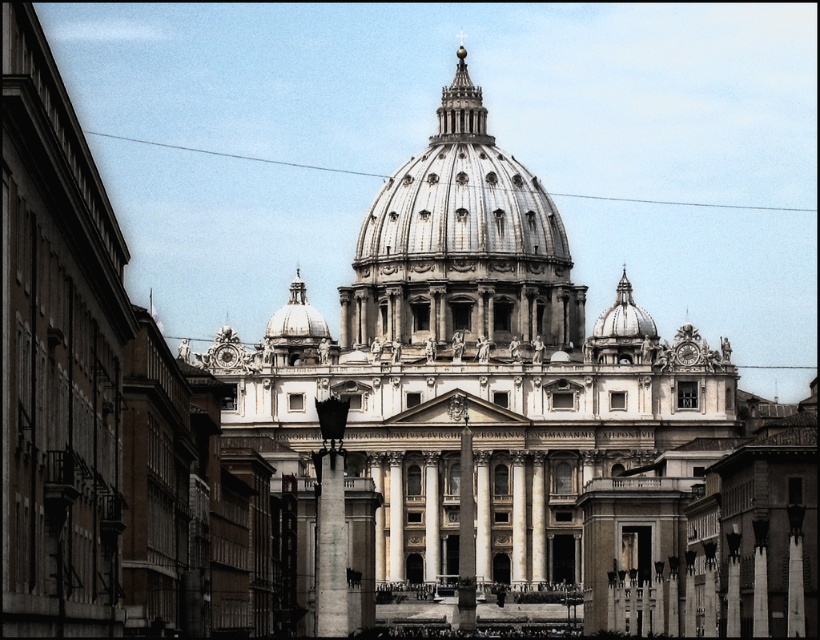
You are standing in front of a historical building and want to take a photo of the shiny silver dome at center. The camera you have can focus on objects up to 160 meters away. Will the dome be in focus?

The shiny silver dome at center is 159.08 meters from viewer, so yes, the camera can focus on it since it is within the 160 meters range.

You are an architect examining the grand structure. You notice the white marble church at center and the white marble pillar at center. Which of these two elements is positioned higher in the image?

The white marble church at center is positioned higher than the white marble pillar at center because the description states that the church is above the pillar.

You are an architect analyzing the building. Which object, the shiny silver dome at center or the white marble pillar at center, is taller?

The shiny silver dome at center is taller than the white marble pillar at center according to the description.